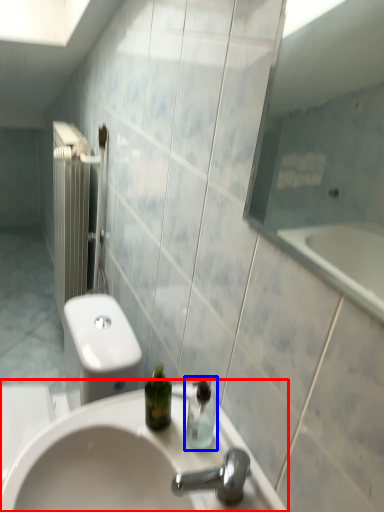
Question: Which of the following is the farthest to the observer, sink (highlighted by a red box) or soap dispenser (highlighted by a blue box)?

Choices:
 (A) sink
 (B) soap dispenser

Answer: (B)